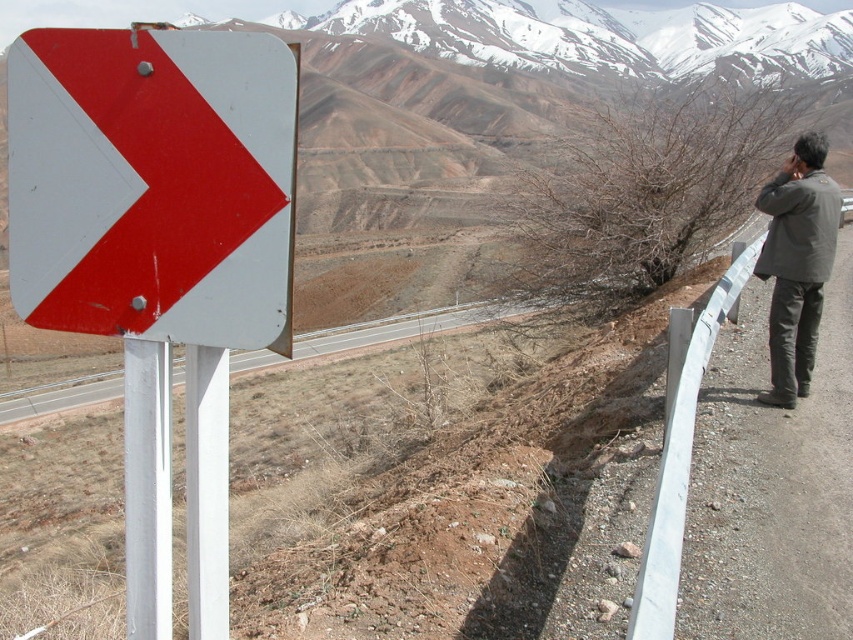
Who is more distant from viewer, (776, 212) or (125, 428)?

The point (776, 212) is more distant.

Who is positioned more to the left, dark green jacket at right or metallic pole at left?

From the viewer's perspective, metallic pole at left appears more on the left side.

You are a GUI agent. You are given a task and a screenshot of the screen. Output one action in this format:
    pyautogui.click(x=<x>, y=<y>)
    Task: Click on the dark green jacket at right
    
    Given the screenshot: What is the action you would take?
    point(798,262)

Where is `dark green jacket at right`? Image resolution: width=853 pixels, height=640 pixels. dark green jacket at right is located at coordinates coord(798,262).

Does metallic pole at left lie in front of silver metallic guardrail at right?

That is True.

Does metallic pole at left appear over silver metallic guardrail at right?

No.

Between point (146, 429) and point (671, 515), which one is positioned behind?

Point (671, 515)

Image resolution: width=853 pixels, height=640 pixels. In order to click on metallic pole at left in this screenshot , I will do `click(148, 488)`.

Who is positioned more to the right, matte plastic arrow at left or dark green jacket at right?

dark green jacket at right

Is matte plastic arrow at left shorter than dark green jacket at right?

Indeed, matte plastic arrow at left has a lesser height compared to dark green jacket at right.

The width and height of the screenshot is (853, 640). Describe the element at coordinates (154, 182) in the screenshot. I see `matte plastic arrow at left` at that location.

Where is `matte plastic arrow at left`? The image size is (853, 640). matte plastic arrow at left is located at coordinates (154, 182).